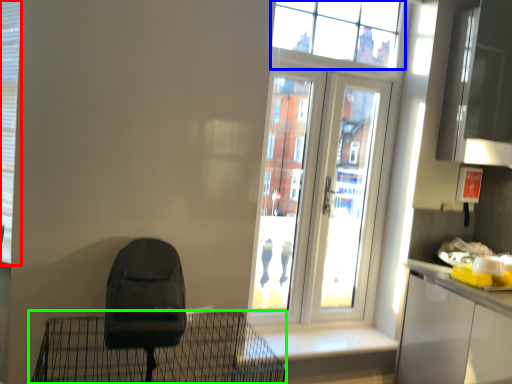
Question: Estimate the real-world distances between objects in this image. Which object is closer to shutter (highlighted by a red box), window (highlighted by a blue box) or furniture (highlighted by a green box)?

Choices:
 (A) window
 (B) furniture

Answer: (B)